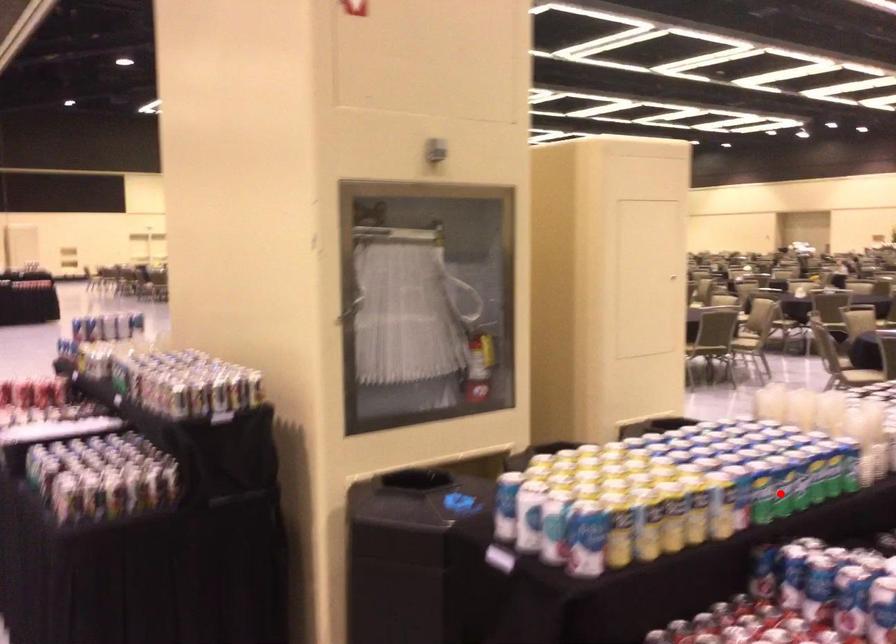
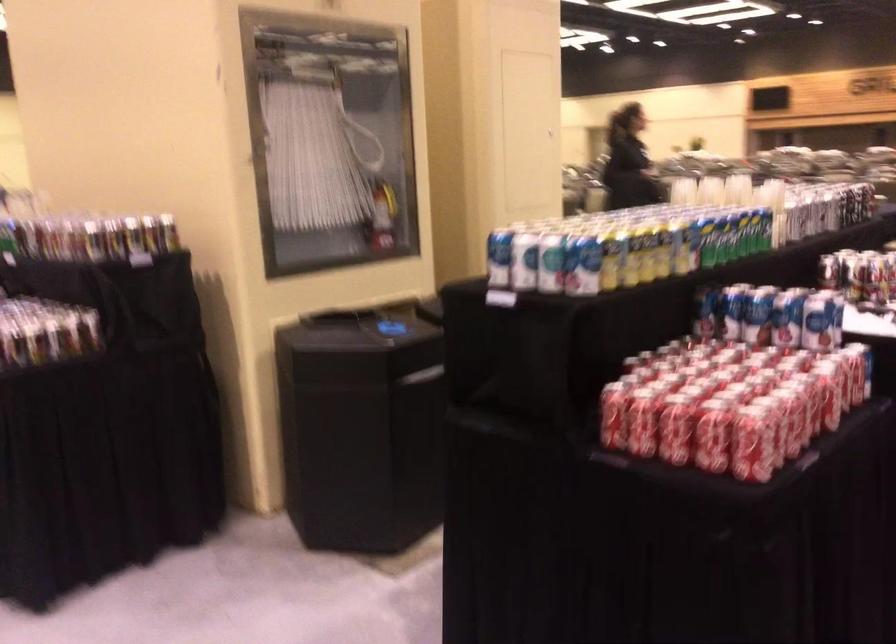
Question: I am providing you with two images of the same scene from different viewpoints. Given a red point in image1, look at the same physical point in image2. Is it:

Choices:
 (A) Closer to the viewpoint
 (B) Farther from the viewpoint

Answer: (B)